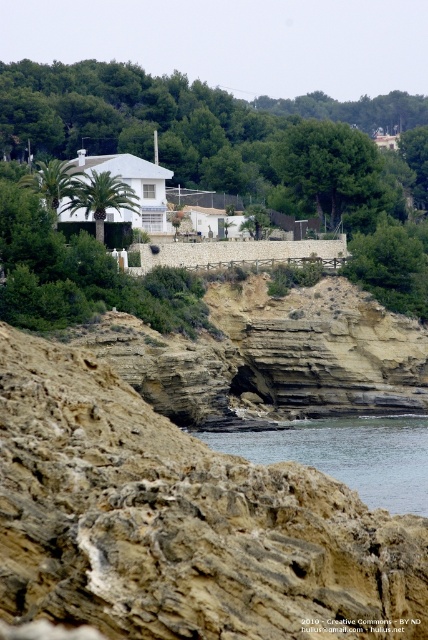
Question: Is brown rocky cliff at lower left positioned before clear water at lower center?

Choices:
 (A) yes
 (B) no

Answer: (A)

Question: Does brown rocky cliff at lower left appear on the right side of clear water at lower center?

Choices:
 (A) yes
 (B) no

Answer: (B)

Question: Is brown rocky cliff at lower left below clear water at lower center?

Choices:
 (A) yes
 (B) no

Answer: (B)

Question: Among these points, which one is farthest from the camera?

Choices:
 (A) (388, 472)
 (B) (217, 486)

Answer: (A)

Question: Which point appears farthest from the camera in this image?

Choices:
 (A) (282, 449)
 (B) (94, 392)

Answer: (A)